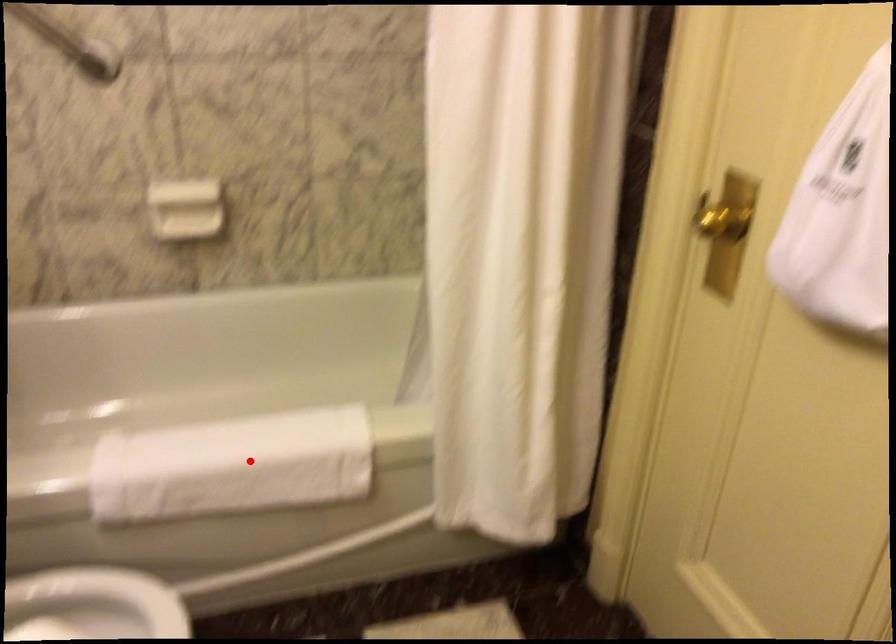
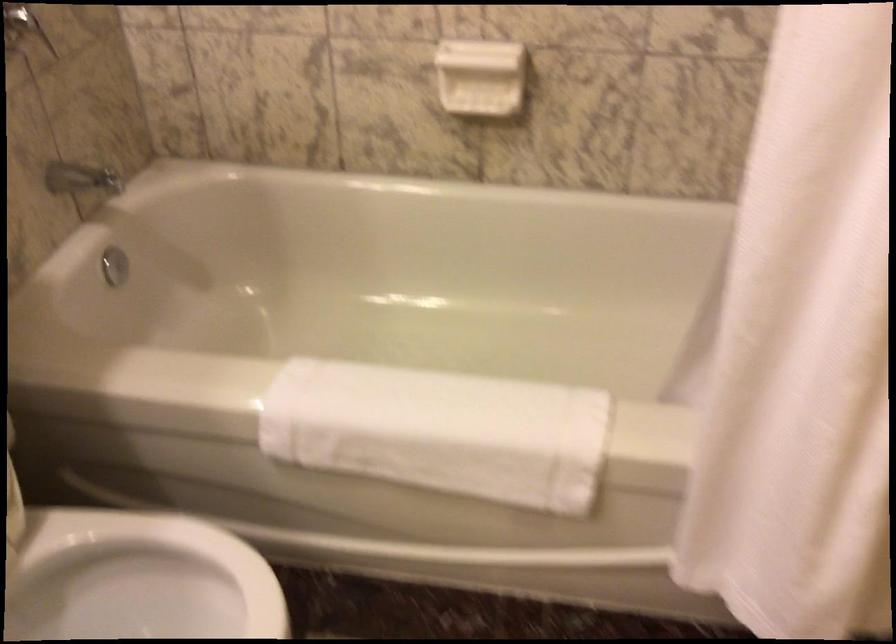
Question: A red point is marked in image1. In image2, is the corresponding 3D point closer to the camera or farther? Reply with the corresponding letter.

Choices:
 (A) The corresponding 3D point is closer.
 (B) The corresponding 3D point is farther.

Answer: (A)